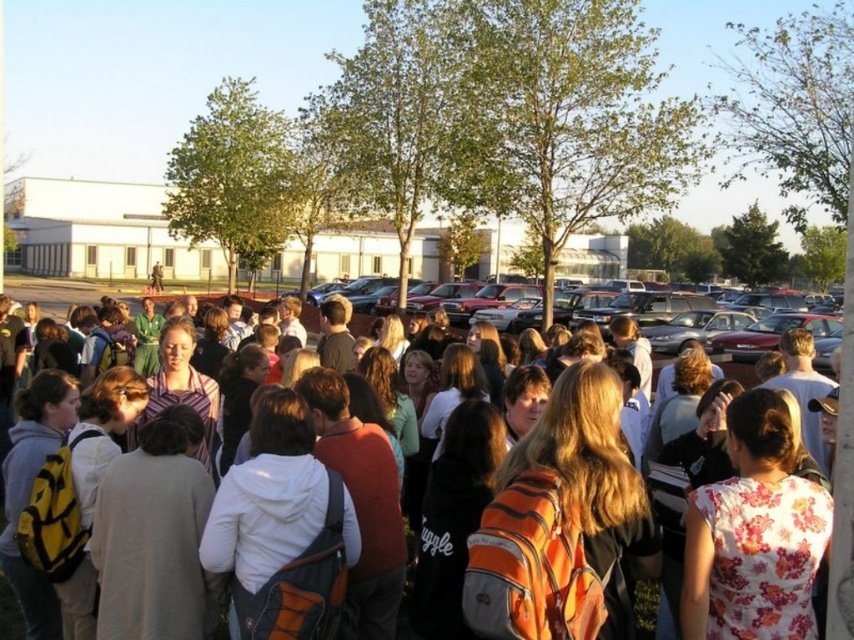
What do you see at coordinates (743, 342) in the screenshot? I see `metallic silver sedan at center` at bounding box center [743, 342].

Does metallic silver sedan at center lie behind orange backpack at center?

Yes, metallic silver sedan at center is behind orange backpack at center.

Is point (814, 316) in front of point (62, 317)?

That is True.

The width and height of the screenshot is (854, 640). I want to click on metallic silver sedan at center, so click(x=743, y=342).